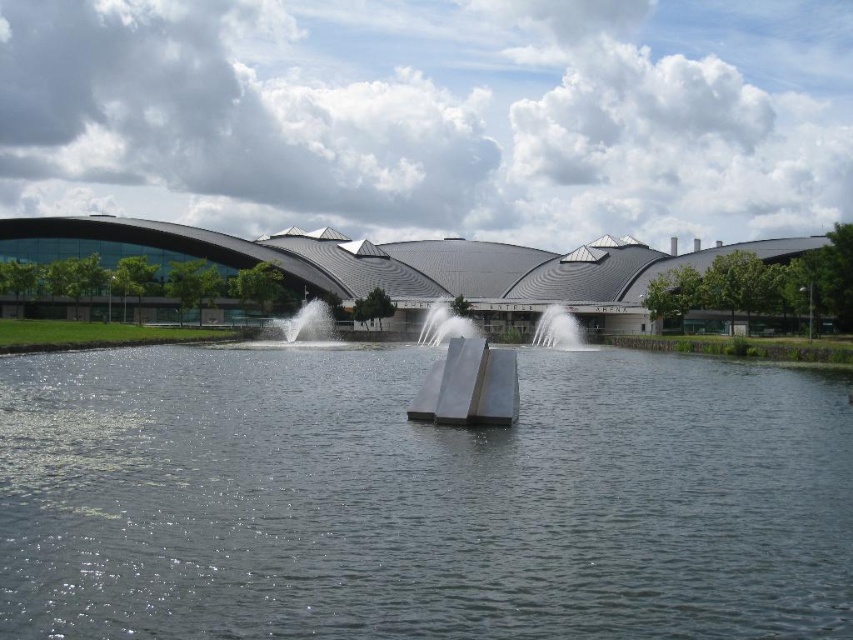
You are standing on the dock and want to walk to the silver metallic fountain at center. Which direction should you head towards from the clear water at center?

The clear water at center is positioned on the left side of the silver metallic fountain at center, so you should head towards the right to reach the fountain.

You are a photographer planning to capture the entire scene in one shot. Given that the clear water at center and the silver metallic fountain at center are both in the frame, which one occupies more space in the photograph?

The clear water at center is bigger than the silver metallic fountain at center, so it occupies more space in the photograph.